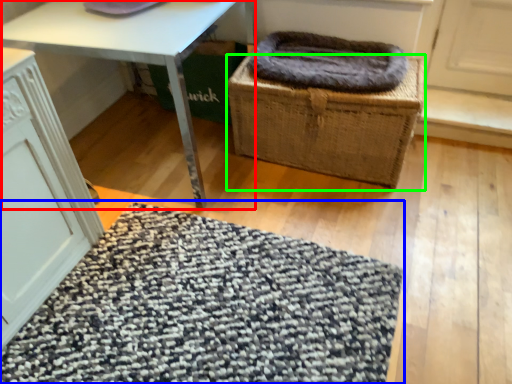
Question: Which is farther away from table (highlighted by a red box)? mat (highlighted by a blue box) or basket (highlighted by a green box)?

Choices:
 (A) mat
 (B) basket

Answer: (A)